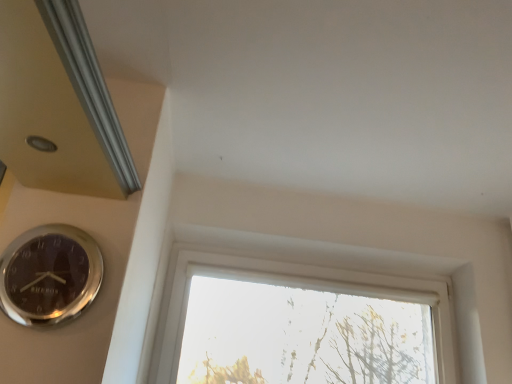
Question: From the image's perspective, does silver metallic wall clock at lower left appear higher than transparent glass window at center?

Choices:
 (A) no
 (B) yes

Answer: (B)

Question: From the image's perspective, does silver metallic wall clock at lower left appear lower than transparent glass window at center?

Choices:
 (A) yes
 (B) no

Answer: (B)

Question: Is silver metallic wall clock at lower left closer to camera compared to transparent glass window at center?

Choices:
 (A) yes
 (B) no

Answer: (A)

Question: Is silver metallic wall clock at lower left bigger than transparent glass window at center?

Choices:
 (A) yes
 (B) no

Answer: (B)

Question: Considering the relative positions of silver metallic wall clock at lower left and transparent glass window at center in the image provided, is silver metallic wall clock at lower left to the left of transparent glass window at center from the viewer's perspective?

Choices:
 (A) no
 (B) yes

Answer: (B)

Question: Is silver metallic wall clock at lower left further to the viewer compared to transparent glass window at center?

Choices:
 (A) no
 (B) yes

Answer: (A)

Question: Is the position of transparent glass window at center less distant than that of silver metallic wall clock at lower left?

Choices:
 (A) yes
 (B) no

Answer: (B)

Question: Is transparent glass window at center at the right side of silver metallic wall clock at lower left?

Choices:
 (A) yes
 (B) no

Answer: (A)

Question: Is silver metallic wall clock at lower left located within transparent glass window at center?

Choices:
 (A) yes
 (B) no

Answer: (B)

Question: Is the depth of transparent glass window at center greater than that of silver metallic wall clock at lower left?

Choices:
 (A) no
 (B) yes

Answer: (B)

Question: Is transparent glass window at center completely or partially outside of silver metallic wall clock at lower left?

Choices:
 (A) yes
 (B) no

Answer: (A)

Question: Could you tell me if transparent glass window at center is facing silver metallic wall clock at lower left?

Choices:
 (A) no
 (B) yes

Answer: (B)

Question: In terms of width, does transparent glass window at center look wider or thinner when compared to silver metallic wall clock at lower left?

Choices:
 (A) wide
 (B) thin

Answer: (A)